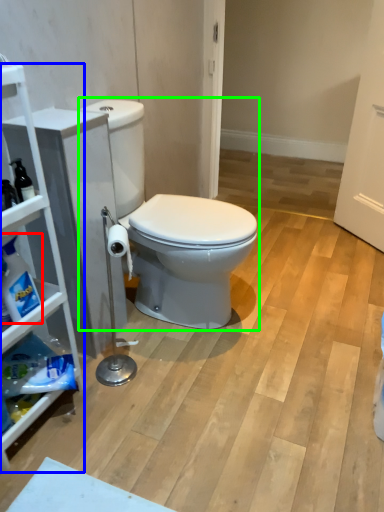
Question: Considering the real-world distances, which object is closest to cleaning product (highlighted by a red box)? cabinetry (highlighted by a blue box) or toilet (highlighted by a green box).

Choices:
 (A) cabinetry
 (B) toilet

Answer: (A)